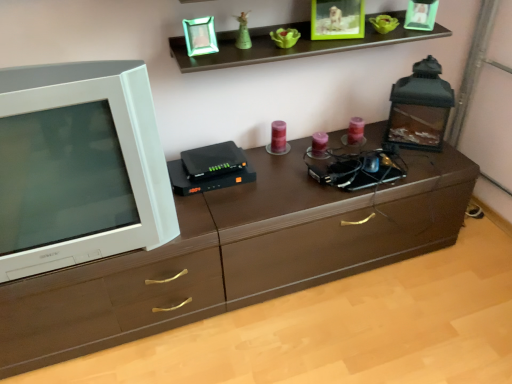
Question: Is green glossy statue at upper center not within brown wood chest of drawers at center?

Choices:
 (A) no
 (B) yes

Answer: (B)

Question: Is green glossy statue at upper center taller than brown wood chest of drawers at center?

Choices:
 (A) yes
 (B) no

Answer: (A)

Question: Considering the relative sizes of green glossy statue at upper center and brown wood chest of drawers at center in the image provided, is green glossy statue at upper center thinner than brown wood chest of drawers at center?

Choices:
 (A) yes
 (B) no

Answer: (A)

Question: From a real-world perspective, is green glossy statue at upper center on top of brown wood chest of drawers at center?

Choices:
 (A) no
 (B) yes

Answer: (B)

Question: Is green glossy statue at upper center positioned behind brown wood chest of drawers at center?

Choices:
 (A) yes
 (B) no

Answer: (A)

Question: Is green glossy statue at upper center to the left or to the right of white glossy television at left in the image?

Choices:
 (A) left
 (B) right

Answer: (B)

Question: Does point (x=245, y=34) appear closer or farther from the camera than point (x=131, y=86)?

Choices:
 (A) closer
 (B) farther

Answer: (B)

Question: Relative to white glossy television at left, is green glossy statue at upper center in front or behind?

Choices:
 (A) front
 (B) behind

Answer: (B)

Question: In terms of width, does green glossy statue at upper center look wider or thinner when compared to white glossy television at left?

Choices:
 (A) thin
 (B) wide

Answer: (A)

Question: In terms of width, does brown wood chest of drawers at center look wider or thinner when compared to white glossy television at left?

Choices:
 (A) thin
 (B) wide

Answer: (B)

Question: From a real-world perspective, is brown wood chest of drawers at center above or below white glossy television at left?

Choices:
 (A) below
 (B) above

Answer: (A)

Question: Is brown wood chest of drawers at center to the left or to the right of white glossy television at left in the image?

Choices:
 (A) left
 (B) right

Answer: (B)

Question: Is brown wood chest of drawers at center situated inside white glossy television at left or outside?

Choices:
 (A) outside
 (B) inside

Answer: (A)

Question: Is green glossy statue at upper center taller or shorter than brown wood chest of drawers at center?

Choices:
 (A) short
 (B) tall

Answer: (B)

Question: Visually, is green glossy statue at upper center positioned to the left or to the right of brown wood chest of drawers at center?

Choices:
 (A) left
 (B) right

Answer: (A)